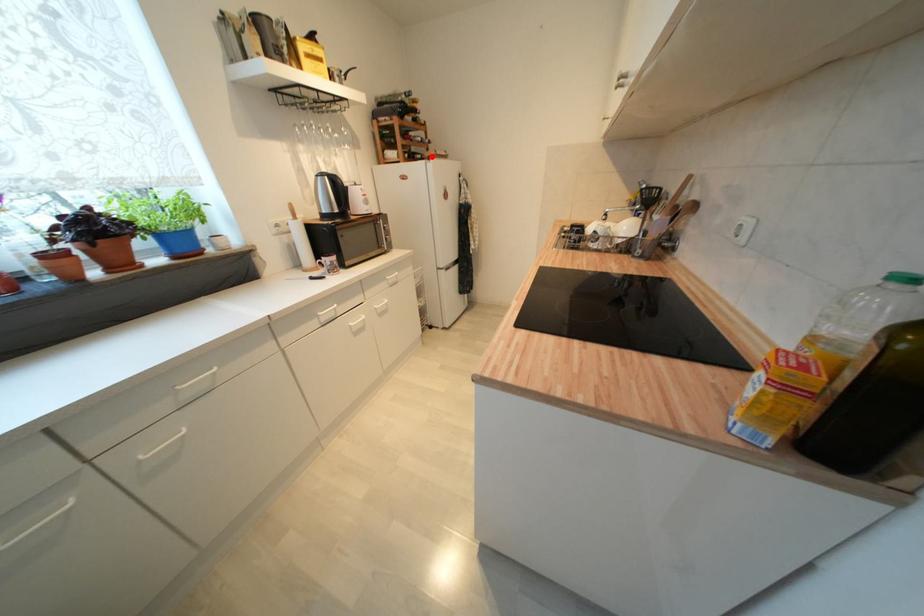
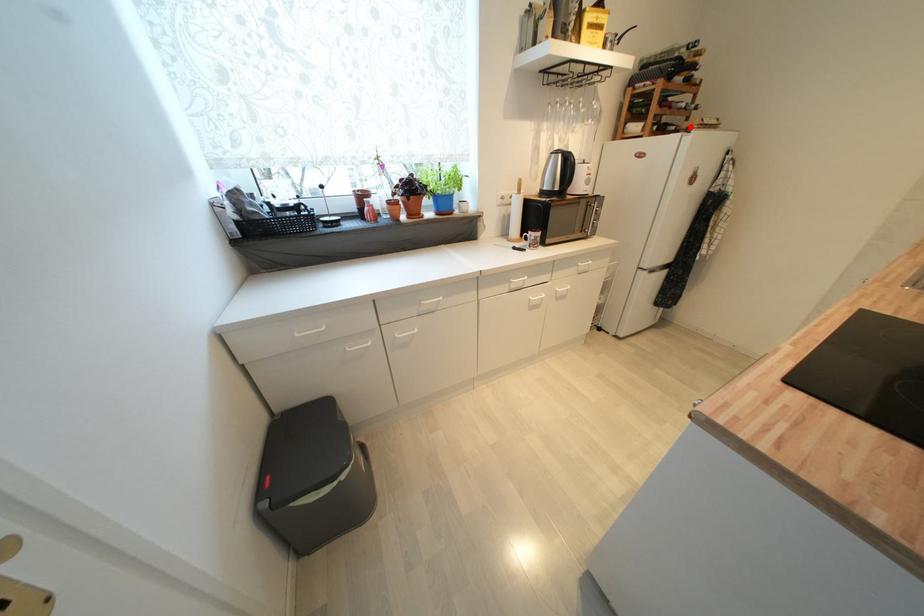
I am providing you with two images of the same scene from different viewpoints. A red point is marked on the first image and another point is marked on the second image. Do the highlighted points in image1 and image2 indicate the same real-world spot?

Yes